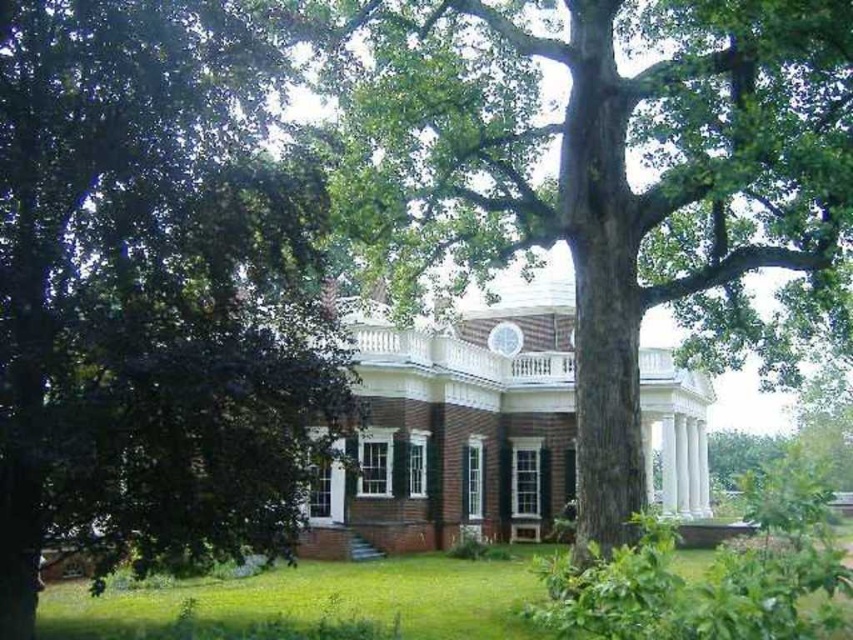
You are standing in front of the mansion and see the smooth brown tree trunk at center. If you were to draw a straight line from your eye level to the tree trunk, would it intersect the mansion or not?

The smooth brown tree trunk at center is located at point (608, 176) in 2D coordinates. Since the mansion is the main structure in the scene, the line from your eye level to the tree trunk would pass through the mansion, so yes, it would intersect the mansion.

You are standing in front of the mansion and notice a smooth brown tree trunk at center and green grass at lower center. Which object is located to the right of the other?

The smooth brown tree trunk at center is positioned on the right side of green grass at lower center.

You are standing in front of the historic mansion and want to take a photo that includes both the green leafy tree at left and the central section of the building. Based on the tree

The green leafy tree at left is located at point (154, 288), which is to the left side of the central section of the building. Therefore, positioning yourself to the left of the central section while ensuring the tree is within the frame should capture both elements in the photo.